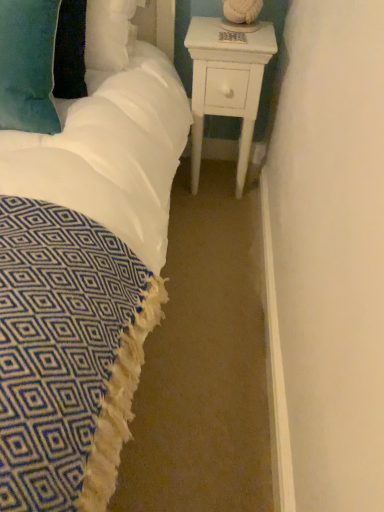
Question: Does white wood nightstand at right lie in front of velvety teal pillow at upper left?

Choices:
 (A) no
 (B) yes

Answer: (A)

Question: Is white wood nightstand at right smaller than velvety teal pillow at upper left?

Choices:
 (A) no
 (B) yes

Answer: (A)

Question: From the image's perspective, is white wood nightstand at right on velvety teal pillow at upper left?

Choices:
 (A) no
 (B) yes

Answer: (A)

Question: Does white wood nightstand at right appear on the right side of velvety teal pillow at upper left?

Choices:
 (A) yes
 (B) no

Answer: (A)

Question: Would you say white wood nightstand at right is a long distance from velvety teal pillow at upper left?

Choices:
 (A) no
 (B) yes

Answer: (A)

Question: From a real-world perspective, is white wood nightstand at right under velvety teal pillow at upper left?

Choices:
 (A) no
 (B) yes

Answer: (B)

Question: Does velvety teal pillow at upper left have a lesser height compared to white wood nightstand at right?

Choices:
 (A) no
 (B) yes

Answer: (B)

Question: Is velvety teal pillow at upper left positioned far away from white wood nightstand at right?

Choices:
 (A) no
 (B) yes

Answer: (A)

Question: From the image's perspective, would you say velvety teal pillow at upper left is positioned over white wood nightstand at right?

Choices:
 (A) yes
 (B) no

Answer: (A)

Question: Can you confirm if velvety teal pillow at upper left is wider than white wood nightstand at right?

Choices:
 (A) no
 (B) yes

Answer: (B)

Question: Is velvety teal pillow at upper left looking in the opposite direction of white wood nightstand at right?

Choices:
 (A) yes
 (B) no

Answer: (B)

Question: Can you confirm if velvety teal pillow at upper left is bigger than white wood nightstand at right?

Choices:
 (A) no
 (B) yes

Answer: (A)

Question: Is point (192, 114) closer or farther from the camera than point (44, 126)?

Choices:
 (A) closer
 (B) farther

Answer: (B)